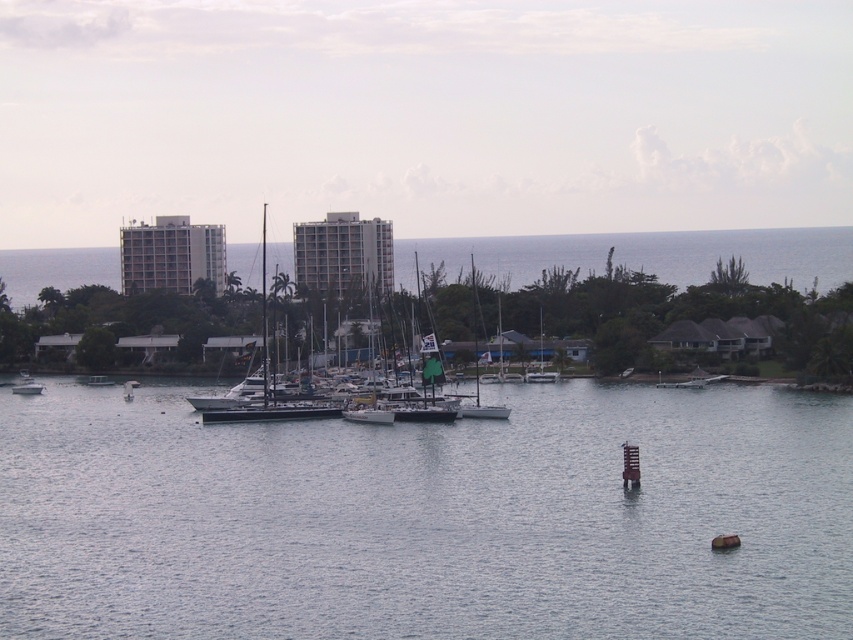
You are a marine biologist studying water clarity in the coastal area shown. You have a device that can measure water clarity at specific coordinates. The coordinates provided are point (x=427, y=516). Based on the scene description, what would the device likely measure at this point?

The device would likely measure clear water at center, as the coordinates point (x=427, y=516) corresponds to clear water at center according to the description.

You are a photographer planning to capture the brown wooden buoy at lower right and the clear water at center in a single shot. Based on their sizes, which object should you focus on first to ensure both are in frame?

The clear water at center is larger in size than the brown wooden buoy at lower right, so you should focus on the clear water at center first to ensure both fit within the frame.

You are a sailor on a boat that is 100 feet long. You are anchored near the dark gray metallic sailboat at center and want to move to the clear water at center. Can your boat fit in the space between them without overlapping?

The distance between the clear water at center and the dark gray metallic sailboat at center is 190.61 feet. Since your boat is 100 feet long, there is enough space to maneuver without overlapping.